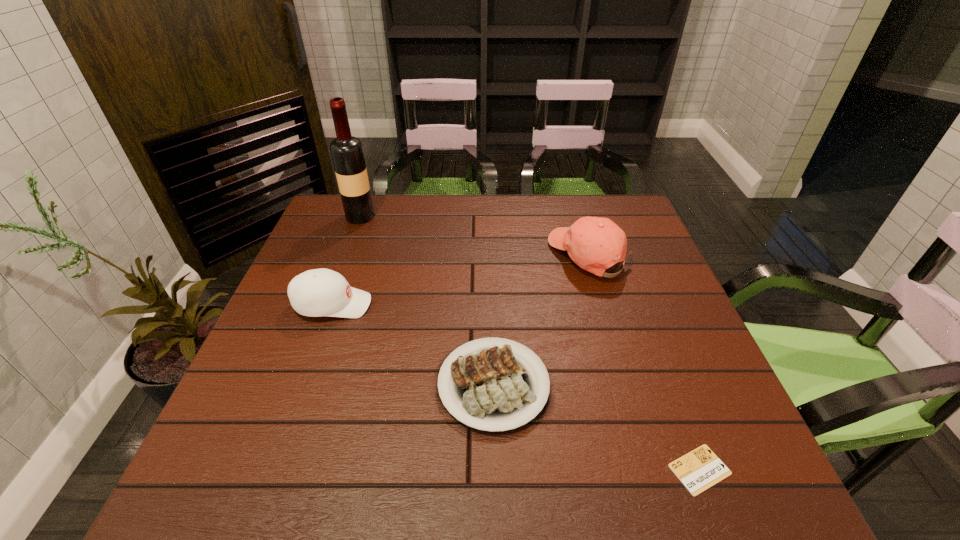
You are a GUI agent. You are given a task and a screenshot of the screen. Output one action in this format:
    pyautogui.click(x=<x>, y=<y>)
    Task: Click on the free space located on the right of the tallest object
    The image size is (960, 540).
    Given the screenshot: What is the action you would take?
    pyautogui.click(x=446, y=217)

Locate an element on the screen. Image resolution: width=960 pixels, height=540 pixels. free space located 0.190m on the left of the taller baseball cap is located at coordinates [484, 256].

The image size is (960, 540). I want to click on vacant region located 0.250m on the front-facing side of the left baseball cap, so click(x=470, y=305).

Image resolution: width=960 pixels, height=540 pixels. What are the coordinates of `vacant region located on the front of the plate` in the screenshot? It's located at tap(496, 486).

This screenshot has height=540, width=960. In order to click on free space located on the left of the shortest object in this screenshot , I will do click(x=452, y=469).

At what (x,y) coordinates should I click in order to perform the action: click on wine bottle that is at the far edge. Please return your answer as a coordinate pair (x, y). Looking at the image, I should click on (346, 150).

The height and width of the screenshot is (540, 960). I want to click on baseball cap present at the far edge, so click(x=595, y=244).

Find the location of a particular element. Image resolution: width=960 pixels, height=540 pixels. object present at the near edge is located at coordinates (698, 470).

I want to click on wine bottle at the left edge, so click(346, 150).

Image resolution: width=960 pixels, height=540 pixels. What are the coordinates of `baseball cap positioned at the left edge` in the screenshot? It's located at (321, 292).